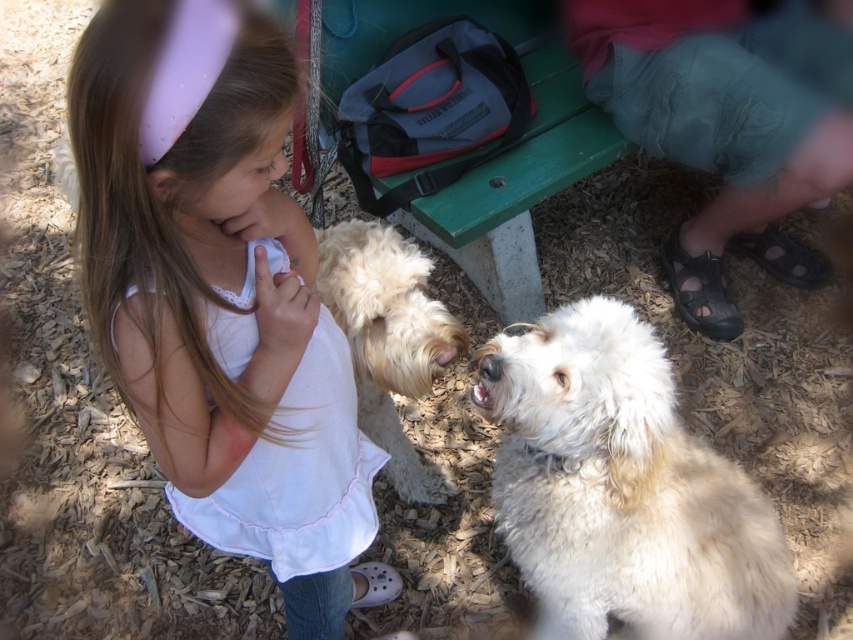
Question: Is fluffy white dog at center positioned before white fur at lower center?

Choices:
 (A) no
 (B) yes

Answer: (A)

Question: Among these points, which one is farthest from the camera?

Choices:
 (A) (410, 456)
 (B) (167, 428)
 (C) (474, 401)
 (D) (611, 492)

Answer: (A)

Question: Considering the real-world distances, which object is closest to the fluffy white dog at center?

Choices:
 (A) white cotton dress at center
 (B) white fluffy dog at center
 (C) white fur at lower center
 (D) white fur nose at center

Answer: (A)

Question: Which object is farther from the camera taking this photo?

Choices:
 (A) white cotton dress at center
 (B) white fluffy dog at center
 (C) white fur nose at center

Answer: (C)

Question: Does white cotton dress at center have a smaller size compared to white fur nose at center?

Choices:
 (A) no
 (B) yes

Answer: (A)

Question: Can you confirm if white cotton dress at center is positioned below fluffy white dog at center?

Choices:
 (A) yes
 (B) no

Answer: (B)